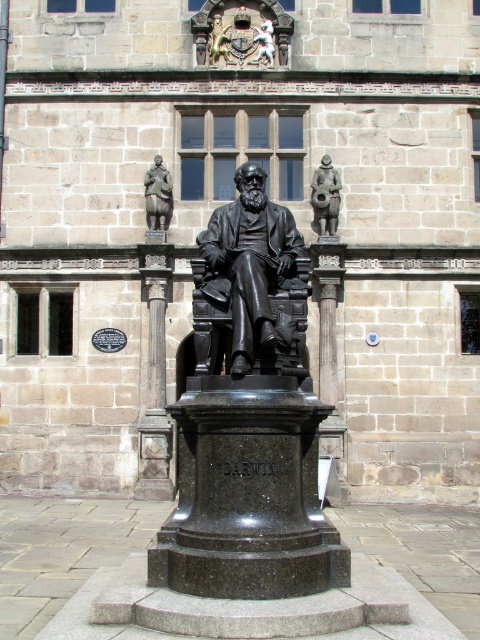
Measure the distance between black polished statue at center and bronze cannon at center.

black polished statue at center and bronze cannon at center are 7.33 meters apart.

Can you confirm if black polished statue at center is thinner than bronze cannon at center?

No, black polished statue at center is not thinner than bronze cannon at center.

Find the location of `black polished statue at center`. black polished statue at center is located at coordinates (250, 264).

In order to click on black polished statue at center in this screenshot , I will do `click(250, 264)`.

Can you confirm if black polished statue at center is thinner than black polished stone pillar at center?

No, black polished statue at center is not thinner than black polished stone pillar at center.

Measure the distance between black polished statue at center and black polished stone pillar at center.

black polished statue at center and black polished stone pillar at center are 12.28 meters apart from each other.

Describe the element at coordinates (250, 264) in the screenshot. I see `black polished statue at center` at that location.

At what (x,y) coordinates should I click in order to perform the action: click on black polished statue at center. Please return your answer as a coordinate pair (x, y). Image resolution: width=480 pixels, height=640 pixels. Looking at the image, I should click on (250, 264).

Who is positioned more to the left, black polished stone pillar at center or bronze cannon at center?

black polished stone pillar at center

The image size is (480, 640). What are the coordinates of `black polished stone pillar at center` in the screenshot? It's located at (155, 380).

Identify the location of black polished stone pillar at center. The image size is (480, 640). (155, 380).